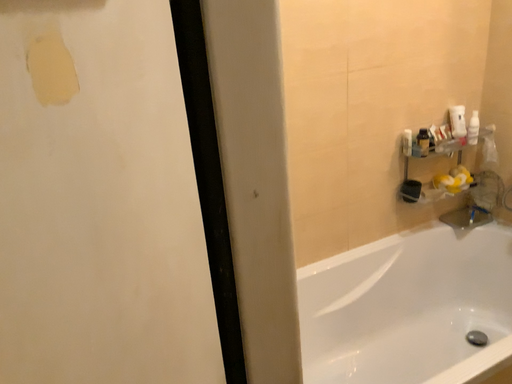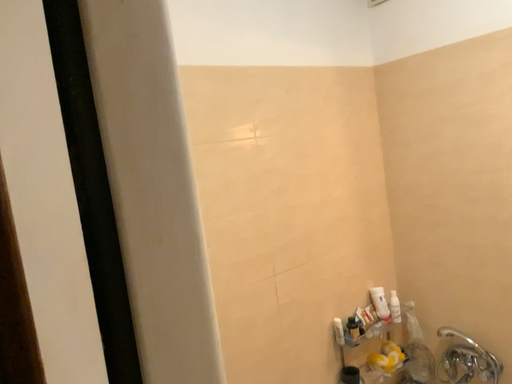
Question: Which way did the camera rotate in the video?

Choices:
 (A) rotated upward
 (B) rotated downward

Answer: (A)